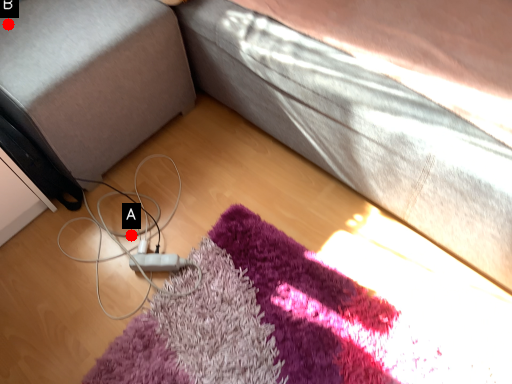
Question: Two points are circled on the image, labeled by A and B beside each circle. Which of the following is the closest to the observer?

Choices:
 (A) A is closer
 (B) B is closer

Answer: (B)